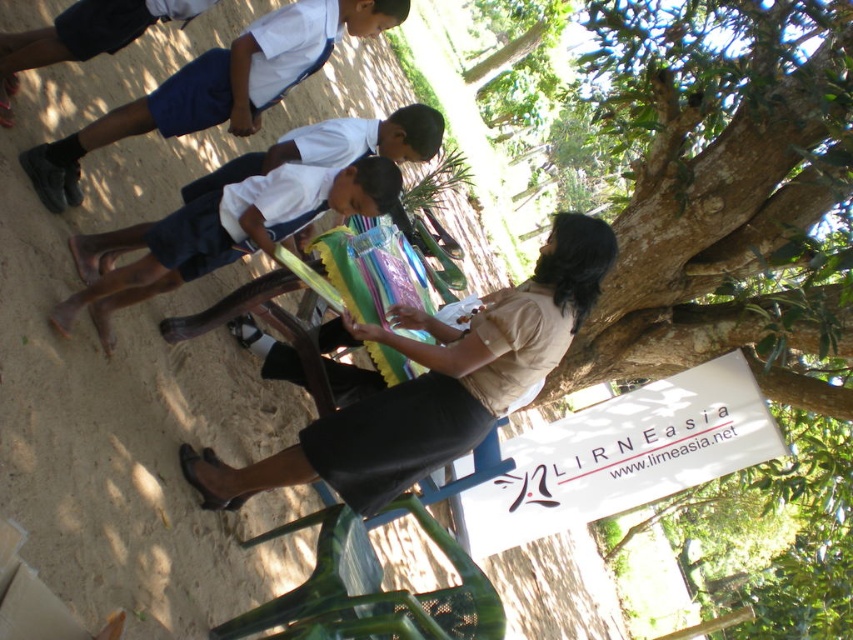
Question: Does white uniform shirt at center appear under white fabric shirt at upper left?

Choices:
 (A) no
 (B) yes

Answer: (B)

Question: Does white uniform shirt at upper left have a smaller size compared to white uniform shirt at center?

Choices:
 (A) yes
 (B) no

Answer: (B)

Question: Which point is closer to the camera?

Choices:
 (A) (271, 64)
 (B) (192, 275)

Answer: (B)

Question: Among these objects, which one is nearest to the camera?

Choices:
 (A) white uniform shirt at center
 (B) white fabric shirt at upper left

Answer: (A)

Question: Which of the following is the farthest from the observer?

Choices:
 (A) white uniform shirt at center
 (B) white shirt at center
 (C) white fabric shirt at upper left
 (D) green rough bark tree at upper right

Answer: (D)

Question: Is white uniform shirt at center behind white fabric shirt at upper left?

Choices:
 (A) yes
 (B) no

Answer: (B)